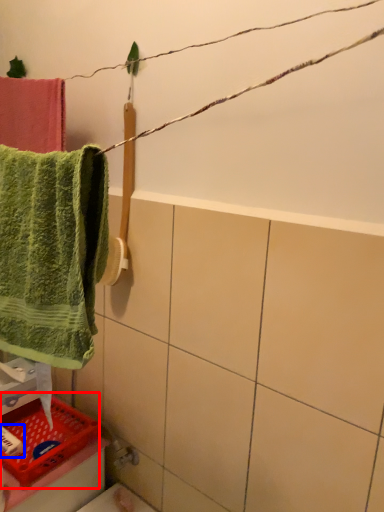
Question: Among these objects, which one is farthest to the camera, basket (highlighted by a red box) or toiletry (highlighted by a blue box)?

Choices:
 (A) basket
 (B) toiletry

Answer: (B)